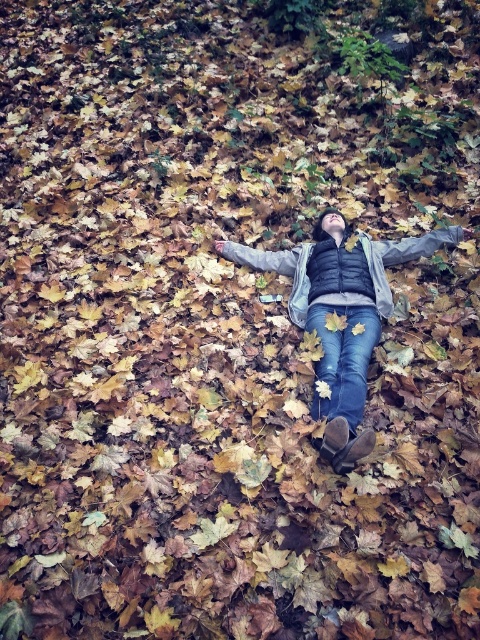
Which is in front, point (363, 358) or point (330, 378)?

Point (330, 378)

Is denim jeans at center bigger than jeans at center?

Yes, denim jeans at center is bigger than jeans at center.

Where is `denim jeans at center`? denim jeans at center is located at coordinates pos(340,314).